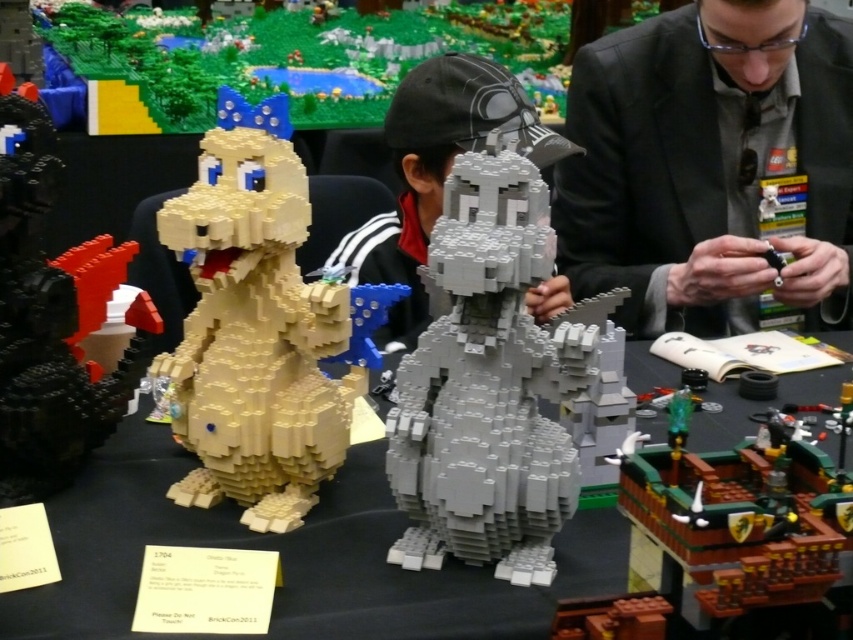
Question: Is matte plastic table at center smaller than brick red dragon at left?

Choices:
 (A) yes
 (B) no

Answer: (B)

Question: Estimate the real-world distances between objects in this image. Which object is closer to the matte black helmet at center?

Choices:
 (A) matte plastic table at center
 (B) matte yellow lego dinosaur at left
 (C) brick red dragon at left

Answer: (A)

Question: Which object is closer to the camera taking this photo?

Choices:
 (A) brick red dragon at left
 (B) matte yellow lego dinosaur at left

Answer: (B)

Question: Can you confirm if gray matte lego dragon at center is positioned to the right of brick red dragon at left?

Choices:
 (A) yes
 (B) no

Answer: (A)

Question: Is gray matte lego dragon at center bigger than brick red dragon at left?

Choices:
 (A) yes
 (B) no

Answer: (A)

Question: Among these points, which one is farthest from the camera?

Choices:
 (A) tap(653, 99)
 (B) tap(56, 449)
 (C) tap(219, 636)

Answer: (A)